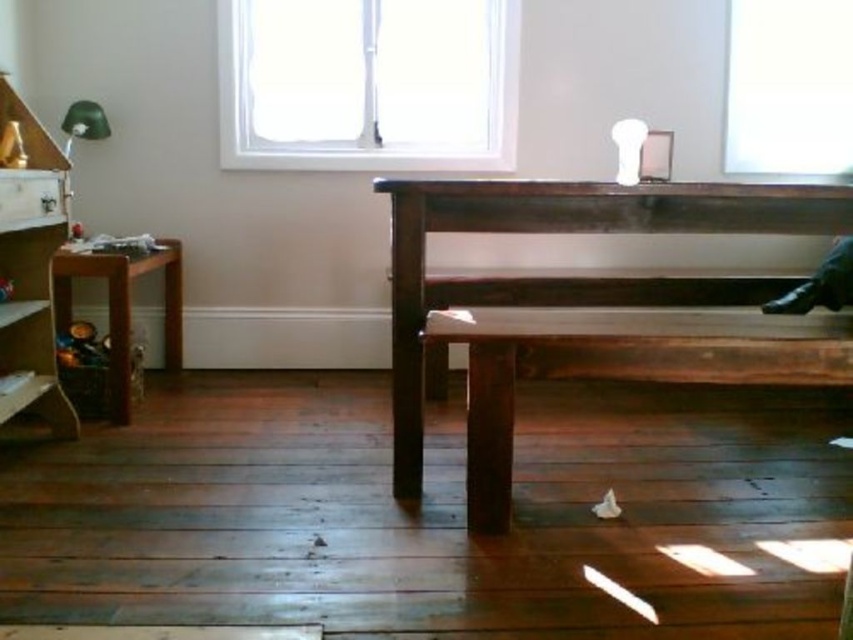
In the scene shown: Is transparent glass window at upper right closer to camera compared to wooden stool at left?

No, it is behind wooden stool at left.

Which is behind, point (758, 68) or point (62, 248)?

The point (758, 68) is behind.

At what (x,y) coordinates should I click in order to perform the action: click on transparent glass window at upper right. Please return your answer as a coordinate pair (x, y). Image resolution: width=853 pixels, height=640 pixels. Looking at the image, I should click on (788, 86).

Does dark brown wooden bench at center appear on the right side of white glass window at upper center?

Yes, dark brown wooden bench at center is to the right of white glass window at upper center.

Between point (466, 464) and point (248, 161), which one is positioned behind?

Positioned behind is point (248, 161).

What are the coordinates of `dark brown wooden bench at center` in the screenshot? It's located at (578, 305).

Does point (62, 225) come farther from viewer compared to point (126, 253)?

No, (62, 225) is in front of (126, 253).

Can you confirm if wooden bookshelf at left is positioned below wooden stool at left?

Actually, wooden bookshelf at left is above wooden stool at left.

Which is in front, point (10, 218) or point (172, 316)?

Point (10, 218) is more forward.

Find the location of a particular element. This screenshot has height=640, width=853. wooden bookshelf at left is located at coordinates (30, 262).